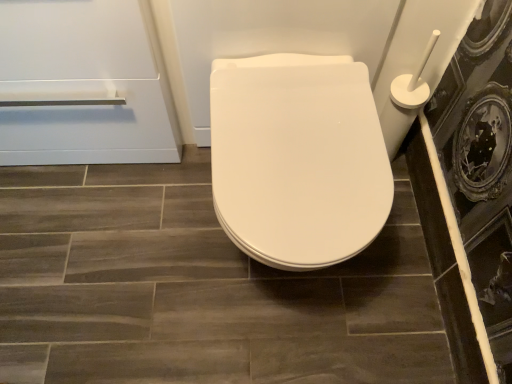
The width and height of the screenshot is (512, 384). What are the coordinates of `vacant space in front of transparent glass screen door at right` in the screenshot? It's located at (406, 319).